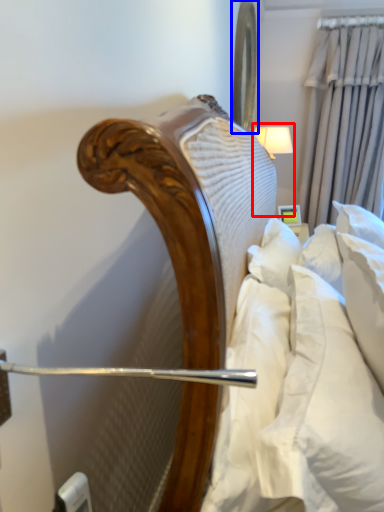
Question: Which of the following is the closest to the observer, bedside lamp (highlighted by a red box) or mirror (highlighted by a blue box)?

Choices:
 (A) bedside lamp
 (B) mirror

Answer: (B)